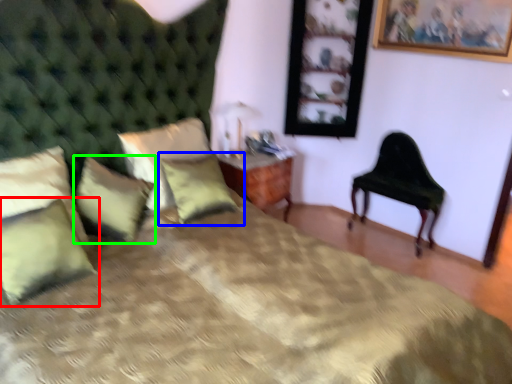
Question: Which is farther away from pillow (highlighted by a red box)? pillow (highlighted by a blue box) or pillow (highlighted by a green box)?

Choices:
 (A) pillow
 (B) pillow

Answer: (A)